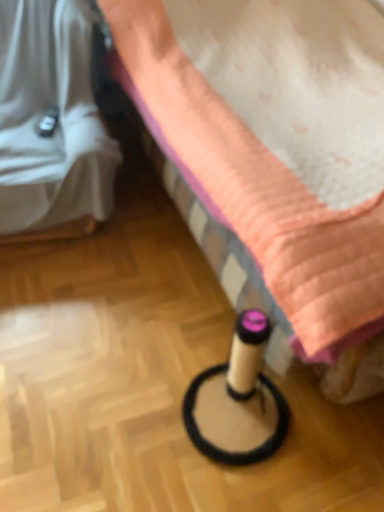
Question: Looking at the image, does white fabric at left, the 2th furniture viewed from the right, seem bigger or smaller compared to beige cardboard tube at lower center, which appears as the 1th furniture when viewed from the right?

Choices:
 (A) big
 (B) small

Answer: (B)

Question: Considering the positions of white fabric at left, the first furniture from the left, and beige cardboard tube at lower center, positioned as the second furniture in left-to-right order, in the image, is white fabric at left, the first furniture from the left, taller or shorter than beige cardboard tube at lower center, positioned as the second furniture in left-to-right order,?

Choices:
 (A) tall
 (B) short

Answer: (B)

Question: In the image, is white fabric at left, the 2th furniture viewed from the right, positioned in front of or behind beige cardboard tube at lower center, positioned as the second furniture in left-to-right order?

Choices:
 (A) front
 (B) behind

Answer: (B)

Question: Is beige cardboard tube at lower center, which appears as the 1th furniture when viewed from the right, wider or thinner than white fabric at left, the 2th furniture viewed from the right?

Choices:
 (A) thin
 (B) wide

Answer: (B)

Question: Is beige cardboard tube at lower center, positioned as the second furniture in left-to-right order, bigger or smaller than white fabric at left, the first furniture from the left?

Choices:
 (A) big
 (B) small

Answer: (A)

Question: From their relative heights in the image, would you say beige cardboard tube at lower center, positioned as the second furniture in left-to-right order, is taller or shorter than white fabric at left, the 2th furniture viewed from the right?

Choices:
 (A) short
 (B) tall

Answer: (B)

Question: Choose the correct answer: Is beige cardboard tube at lower center, positioned as the second furniture in left-to-right order, inside white fabric at left, the 2th furniture viewed from the right, or outside it?

Choices:
 (A) outside
 (B) inside

Answer: (A)